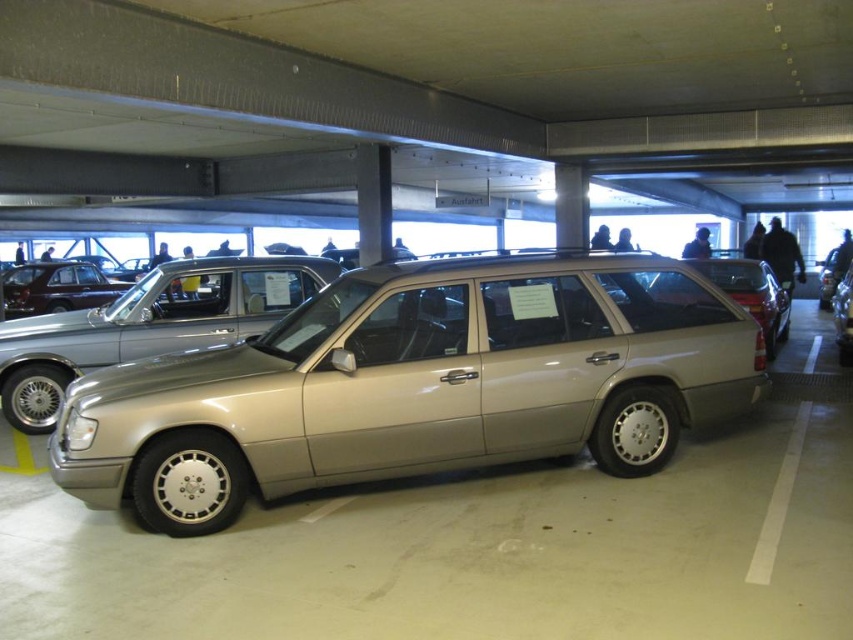
Is point (65, 448) in front of point (44, 289)?

Yes, it is in front of point (44, 289).

Is satin gold station wagon at center behind shiny dark brown car at center?

No, satin gold station wagon at center is closer to the viewer.

At what (x,y) coordinates should I click in order to perform the action: click on satin gold station wagon at center. Please return your answer as a coordinate pair (x, y). Looking at the image, I should click on (416, 385).